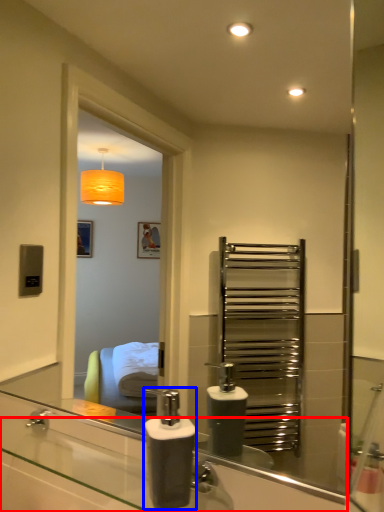
Question: Which of the following is the closest to the observer, counter top (highlighted by a red box) or soap dispenser (highlighted by a blue box)?

Choices:
 (A) counter top
 (B) soap dispenser

Answer: (A)